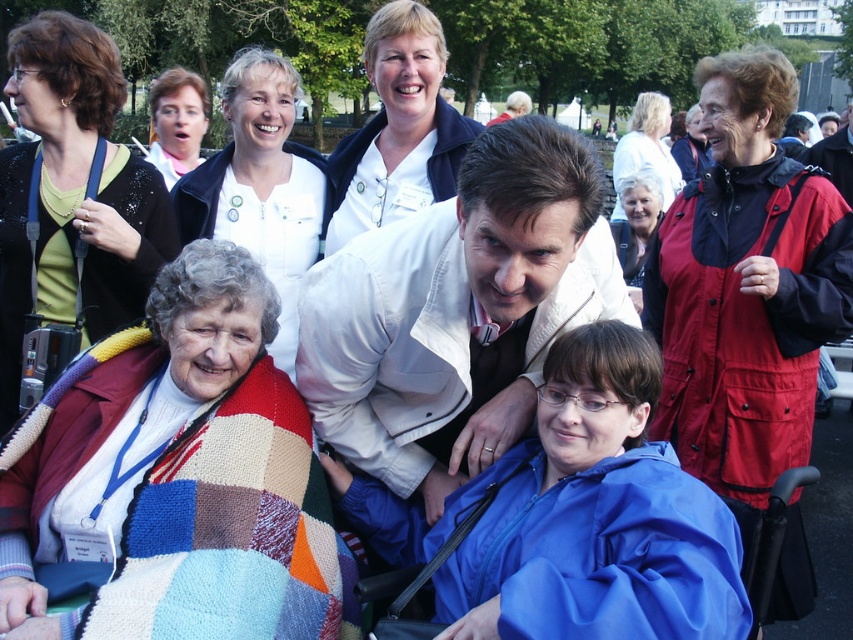
You are organizing a photo shoot and need to place a 1.2 meter wide backdrop behind the blue matte jacket at center and the white matte jacket at upper center. Based on their widths, will the backdrop cover both subjects adequately?

The blue matte jacket at center might be wider than white matte jacket at upper center, so the 1.2 meter wide backdrop may not cover both adequately if the combined width of both exceeds the backdrop size. However, since the exact width difference isn not specified, it is uncertain. Consider measuring or using a larger backdrop to ensure coverage.

You are organizing a photo shoot and need to ensure that all subjects are visible in the frame. Given the white matte jacket at center and the red nylon jacket at upper right, which jacket should you focus on to ensure both are visible without crowding the frame?

The white matte jacket at center occupies less space than the red nylon jacket at upper right, so focusing on the red nylon jacket at upper right would allow both to be visible without overcrowding the frame since it takes up more space and can be positioned to accommodate the smaller jacket.

You are a photographer trying to capture a photo of the two people in wheelchairs in the park scene. You notice the red nylon jacket at upper right and the white textured sweater at upper right in the background. Which clothing item is positioned lower in the frame?

The red nylon jacket at upper right is positioned below the white textured sweater at upper right, so it is lower in the frame.